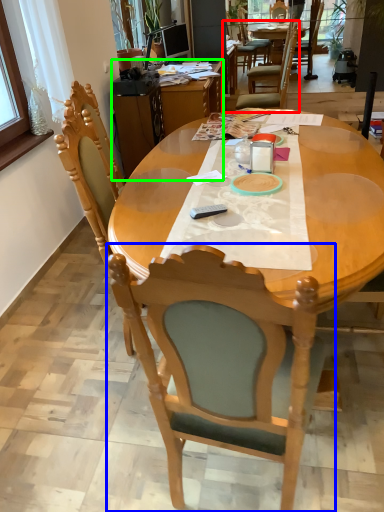
Question: Which is nearer to the chair (highlighted by a red box)? chair (highlighted by a blue box) or desk (highlighted by a green box).

Choices:
 (A) chair
 (B) desk

Answer: (B)